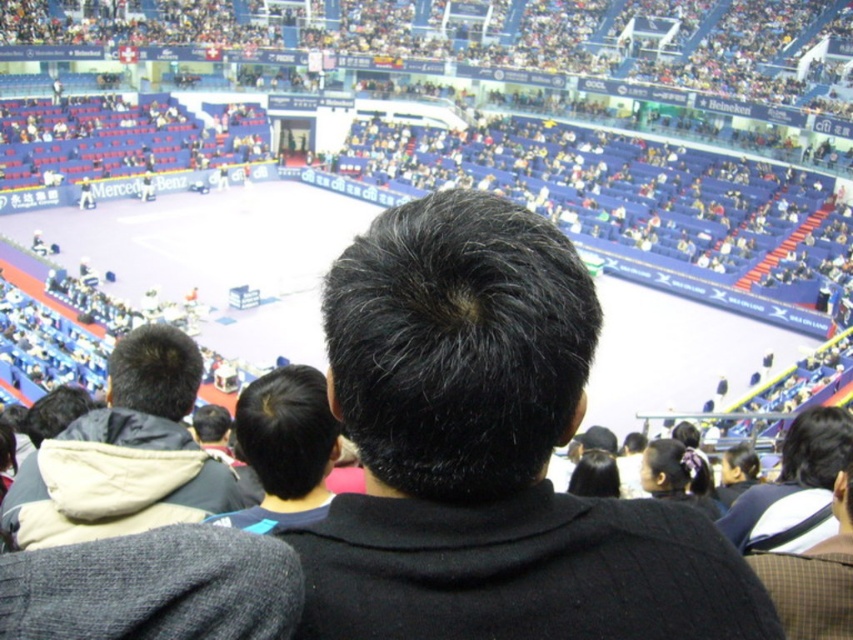
Is dark gray jacket at center shorter than dark brown hair at center?

No, dark gray jacket at center is not shorter than dark brown hair at center.

Is dark gray jacket at center positioned at the back of dark brown hair at center?

No, it is in front of dark brown hair at center.

What do you see at coordinates (125, 454) in the screenshot? I see `dark gray jacket at center` at bounding box center [125, 454].

Where is `dark gray jacket at center`? The width and height of the screenshot is (853, 640). dark gray jacket at center is located at coordinates (125, 454).

Does black matte hair at center have a larger size compared to dark gray jacket at center?

Correct, black matte hair at center is larger in size than dark gray jacket at center.

Based on the photo, measure the distance between point (670, 524) and camera.

A distance of 25.42 meters exists between point (670, 524) and camera.

Locate an element on the screen. The height and width of the screenshot is (640, 853). black matte hair at center is located at coordinates (489, 452).

This screenshot has height=640, width=853. Describe the element at coordinates (489, 452) in the screenshot. I see `black matte hair at center` at that location.

Who is positioned more to the right, black matte hair at center or dark brown hair at center?

black matte hair at center

Locate an element on the screen. Image resolution: width=853 pixels, height=640 pixels. black matte hair at center is located at coordinates (489, 452).